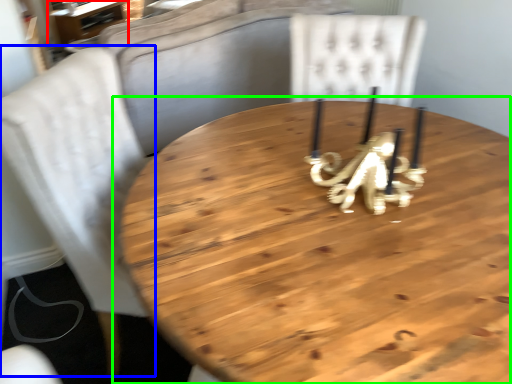
Question: Which object is positioned farthest from table (highlighted by a red box)? Select from chair (highlighted by a blue box) and table (highlighted by a green box).

Choices:
 (A) chair
 (B) table

Answer: (B)